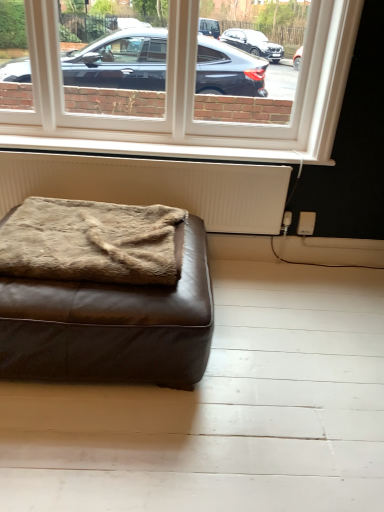
What are the coordinates of `empty space that is ontop of white textured radiator at lower center (from a real-world perspective)` in the screenshot? It's located at [153, 152].